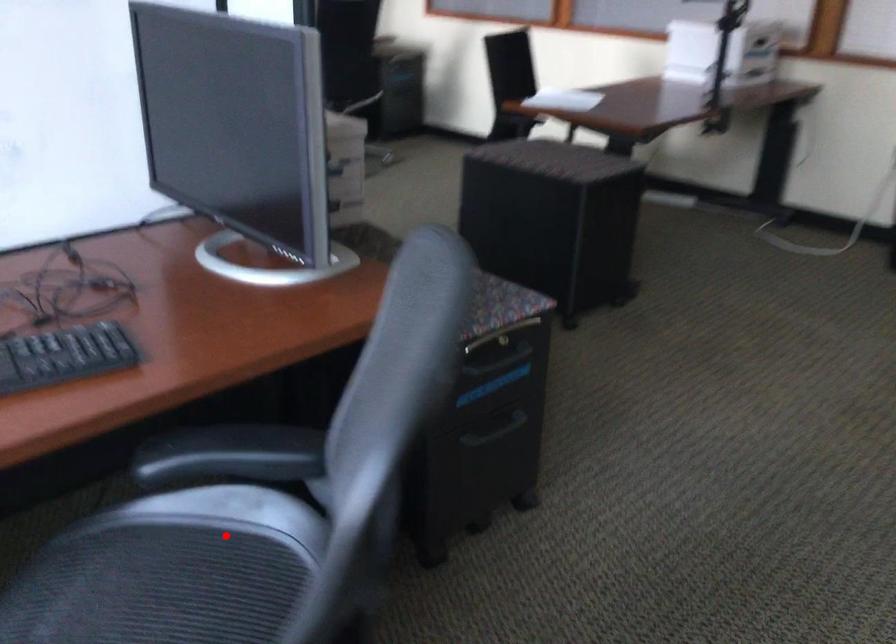
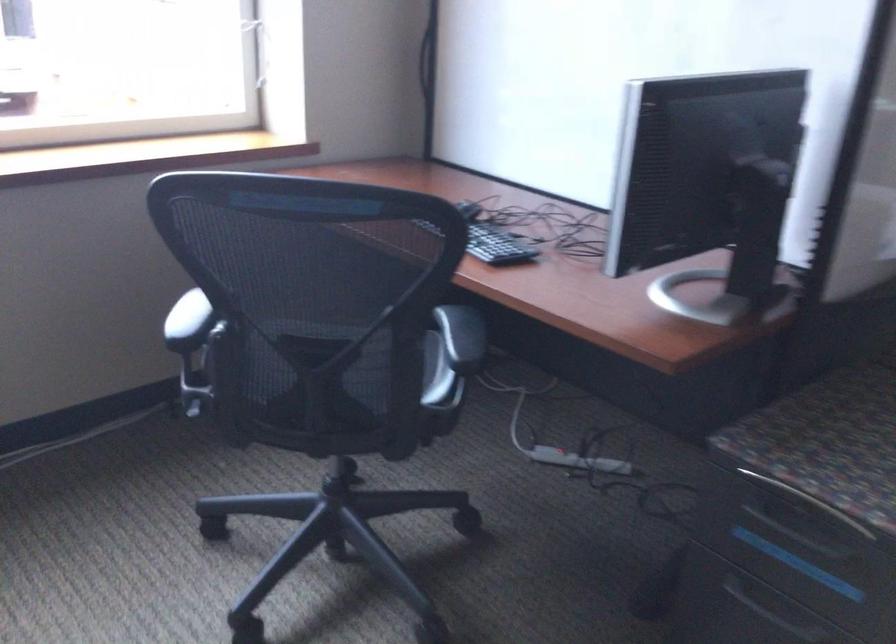
Question: I am providing you with two images of the same scene from different viewpoints. A red point is shown in image1. For the corresponding object point in image2, is it positioned nearer or farther from the camera?

Choices:
 (A) Nearer
 (B) Farther

Answer: (B)